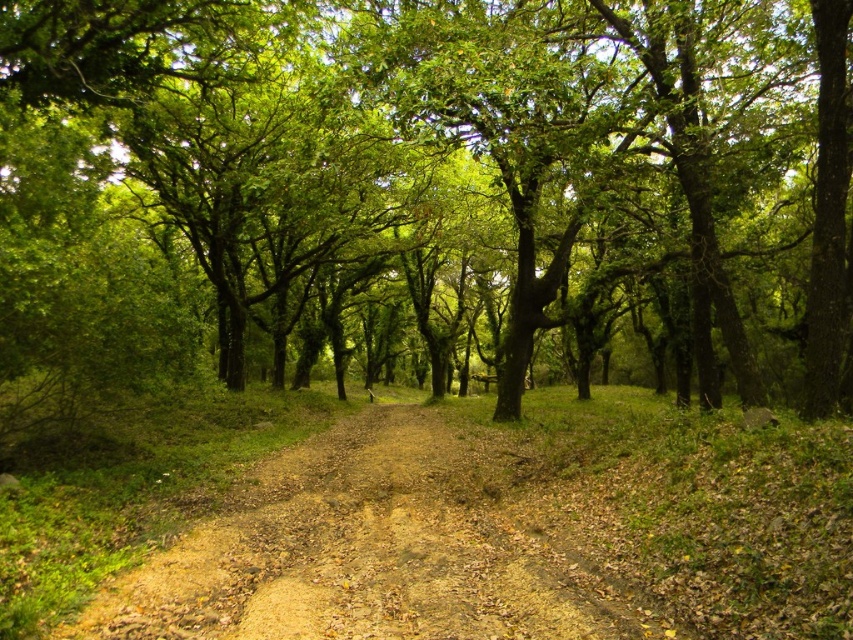
Question: Which point is closer to the camera taking this photo?

Choices:
 (A) (538, 621)
 (B) (598, 61)

Answer: (A)

Question: Can you confirm if green leafy tree at center is bigger than brown dirt track at center?

Choices:
 (A) no
 (B) yes

Answer: (B)

Question: Is green leafy tree at center below brown dirt track at center?

Choices:
 (A) yes
 (B) no

Answer: (B)

Question: Which point is closer to the camera taking this photo?

Choices:
 (A) (374, 632)
 (B) (135, 262)

Answer: (A)

Question: Can you confirm if green leafy tree at center is positioned below brown dirt track at center?

Choices:
 (A) yes
 (B) no

Answer: (B)